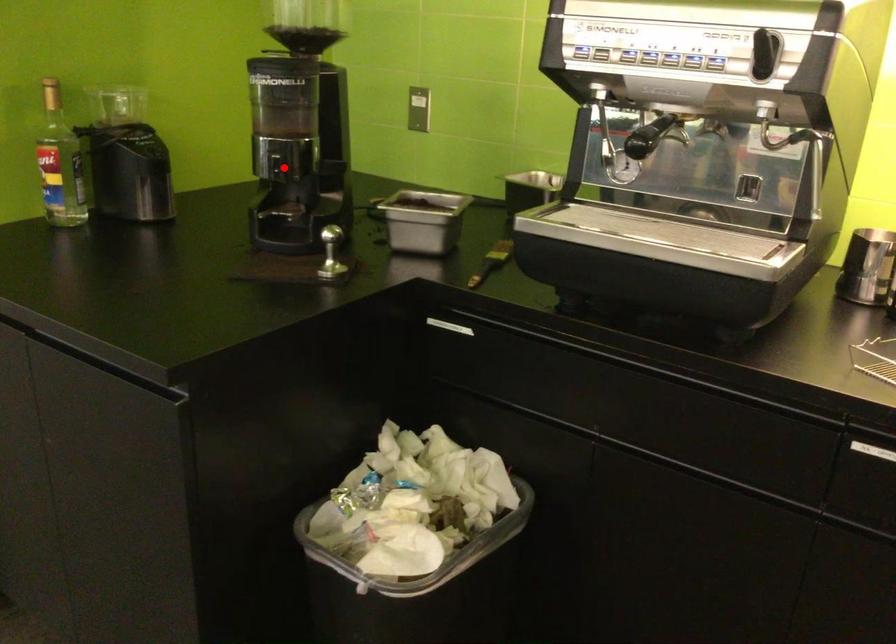
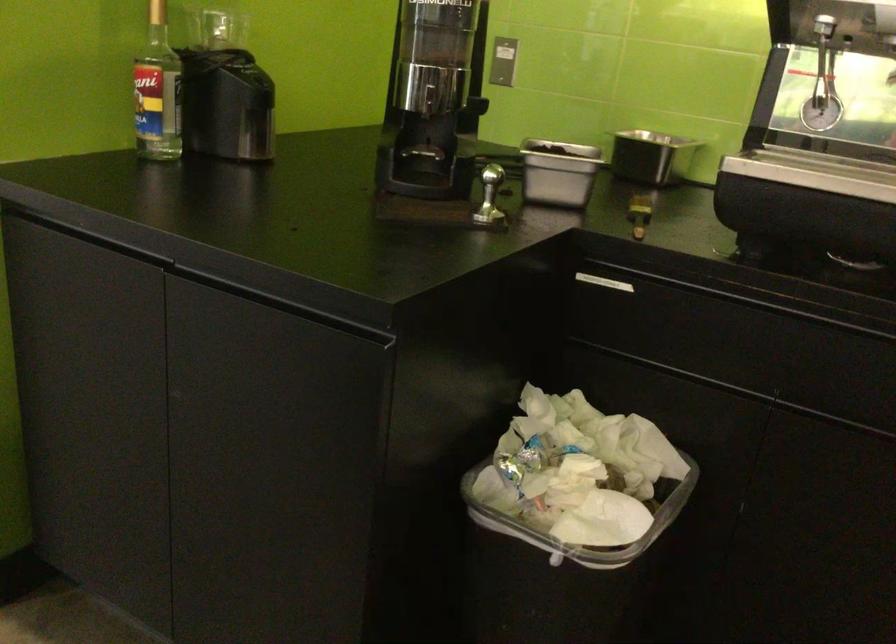
Where in the second image is the point corresponding to the highlighted location from the first image?

(433, 100)